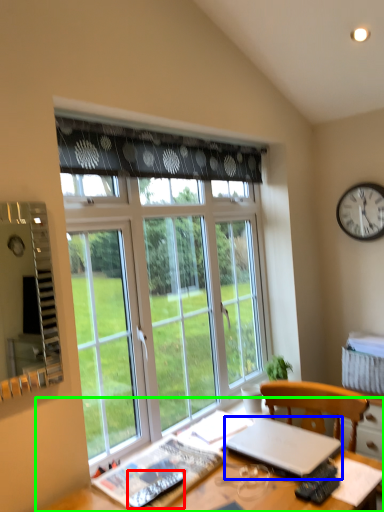
Question: Which object is the closest to the remote (highlighted by a red box)? Choose among these: laptop (highlighted by a blue box) or desk (highlighted by a green box).

Choices:
 (A) laptop
 (B) desk

Answer: (B)